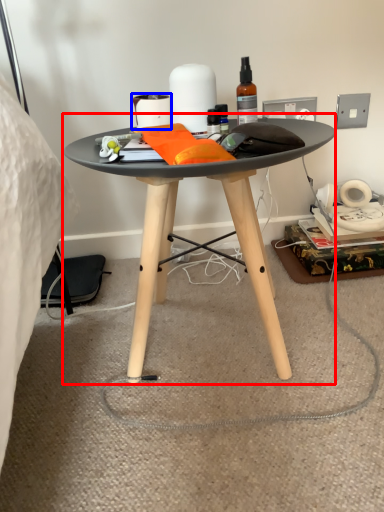
Question: Which object appears closest to the camera in this image, coffee table (highlighted by a red box) or toilet paper (highlighted by a blue box)?

Choices:
 (A) coffee table
 (B) toilet paper

Answer: (A)